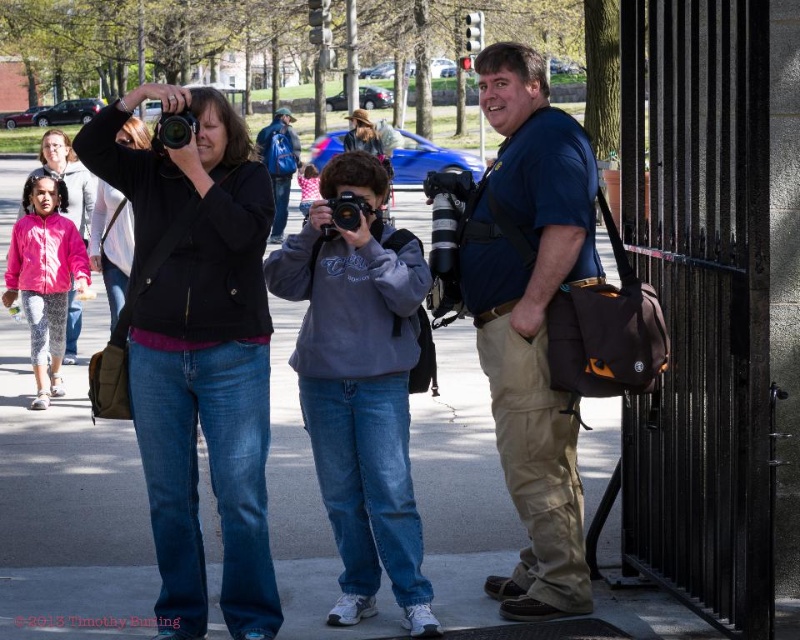
Question: Is the position of gray fleece sweatshirt at center more distant than that of blue backpack at center?

Choices:
 (A) yes
 (B) no

Answer: (B)

Question: Among these points, which one is nearest to the camera?

Choices:
 (A) (286, 282)
 (B) (176, 147)
 (C) (576, 502)
 (D) (277, 168)

Answer: (B)

Question: Is pink fleece jacket at left to the right of black plastic camera at center from the viewer's perspective?

Choices:
 (A) yes
 (B) no

Answer: (B)

Question: Does gray fleece sweatshirt at center appear on the right side of pink fleece jacket at left?

Choices:
 (A) yes
 (B) no

Answer: (A)

Question: Among these objects, which one is nearest to the camera?

Choices:
 (A) black plastic camera at center
 (B) blue backpack at center
 (C) matte black camera at center
 (D) pink fleece jacket at left

Answer: (C)

Question: Which point is closer to the camera taking this photo?

Choices:
 (A) (274, 145)
 (B) (336, 218)
 (C) (158, 292)
 (D) (560, 218)

Answer: (C)